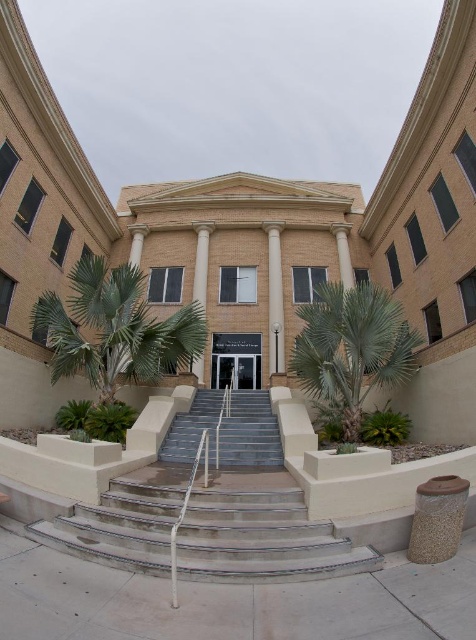
Question: Which point is closer to the camera?

Choices:
 (A) (100, 276)
 (B) (198, 276)

Answer: (A)

Question: Among these objects, which one is nearest to the camera?

Choices:
 (A) metallic silver stairs at center
 (B) green leafy palm tree at center
 (C) green leafy palm tree at left

Answer: (A)

Question: Does metallic silver stairs at center lie in front of gray concrete stairs at center?

Choices:
 (A) yes
 (B) no

Answer: (A)

Question: Can you confirm if white marble pillar at center is wider than white smooth column at center?

Choices:
 (A) no
 (B) yes

Answer: (A)

Question: Is green leafy palm tree at left below white smooth column at center?

Choices:
 (A) yes
 (B) no

Answer: (A)

Question: Which object appears closest to the camera in this image?

Choices:
 (A) gray concrete stairs at center
 (B) matte glass door at center
 (C) white smooth column at center

Answer: (A)